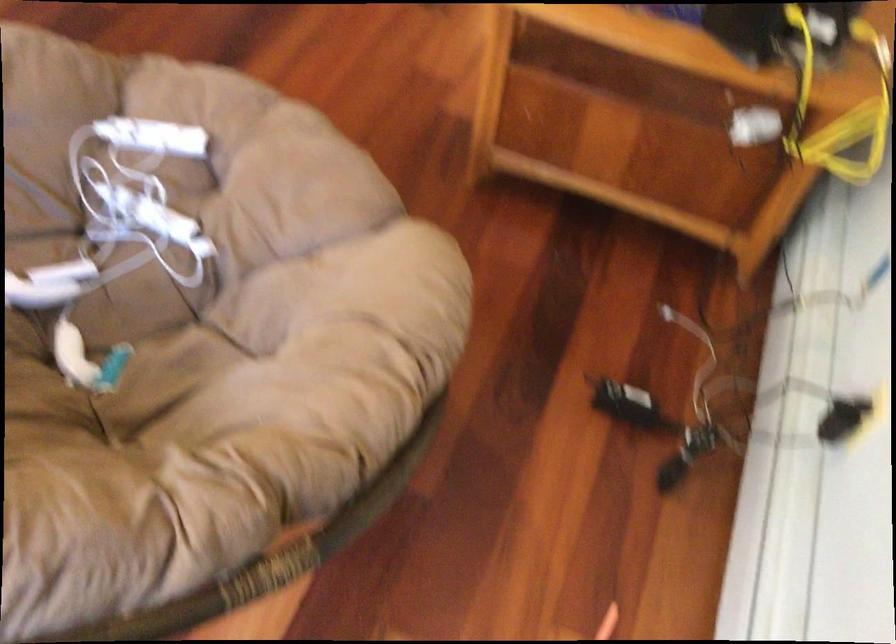
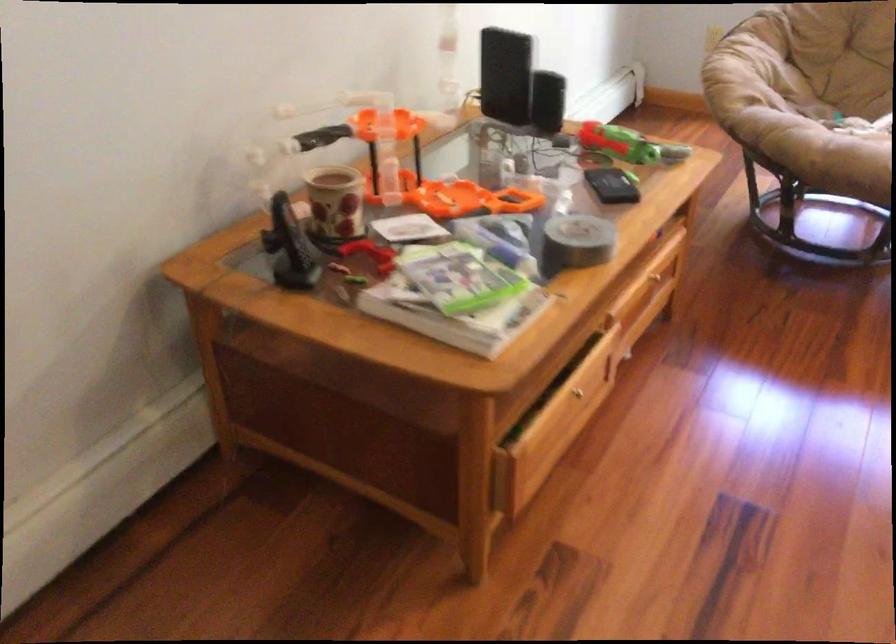
Question: I am providing you with two images of the same scene from different viewpoints. After the viewpoint changes to image2, which objects are now occluded?

Choices:
 (A) black power adapter
 (B) yellow floor mat
 (C) gold drawer handle
 (D) orange plastic handle

Answer: (A)